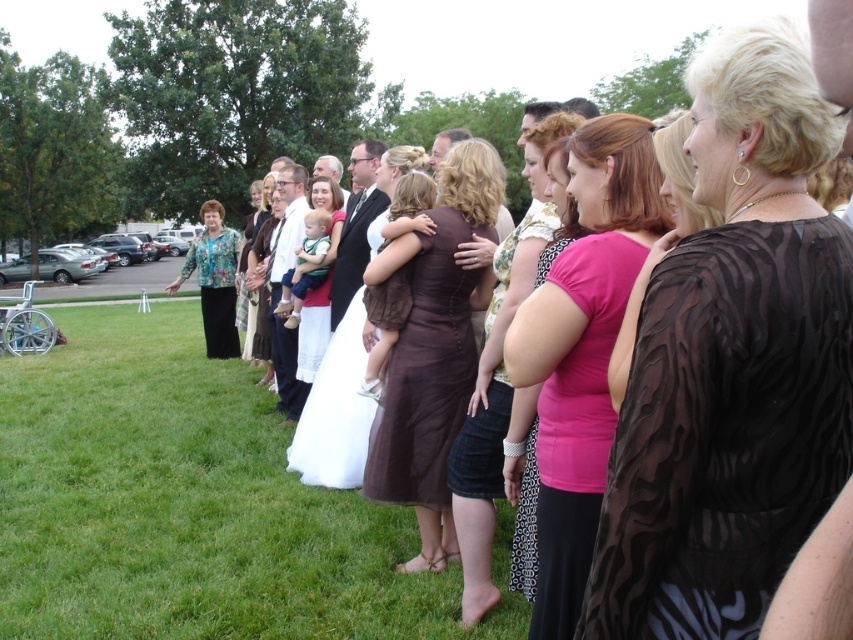
Question: Does pink sheer blouse at center lie in front of pink fabric dress at center?

Choices:
 (A) yes
 (B) no

Answer: (A)

Question: Does green grass at lower left lie behind pink sheer blouse at center?

Choices:
 (A) no
 (B) yes

Answer: (B)

Question: Which object is positioned farthest from the brown sheer dress at center?

Choices:
 (A) pink sheer blouse at center
 (B) green grass at lower left
 (C) pink fabric dress at center

Answer: (B)

Question: Among these objects, which one is nearest to the camera?

Choices:
 (A) black sheer dress at center
 (B) green grass at lower left

Answer: (A)

Question: Which object is the closest to the green grass at lower left?

Choices:
 (A) brown sheer dress at center
 (B) pink sheer blouse at center
 (C) black sheer dress at center

Answer: (A)

Question: Is black sheer dress at center below green grass at lower left?

Choices:
 (A) yes
 (B) no

Answer: (B)